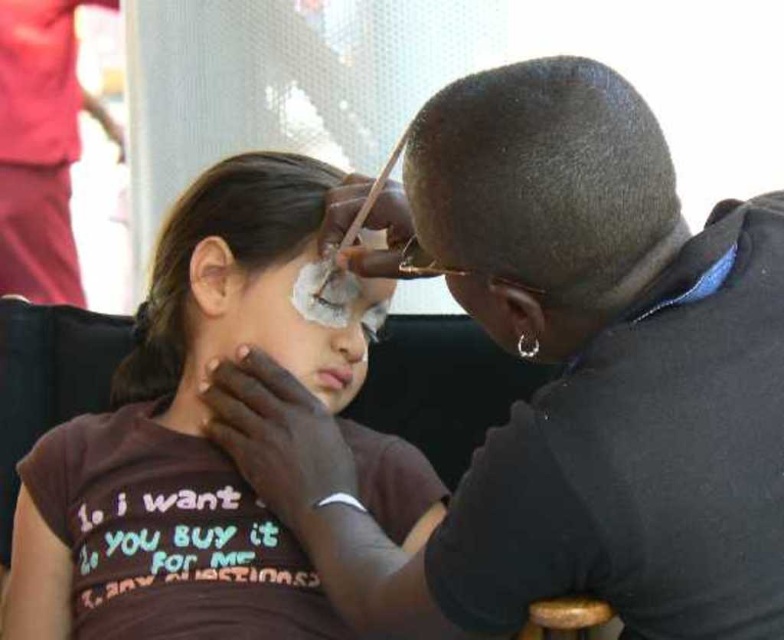
You are a photographer trying to capture a closeup of the makeup application process. You need to focus on either the point at (x=434, y=624) or the point at (x=321, y=330). Which point should you choose to ensure the closest subject detail?

Point (x=434, y=624) is closer to the camera than point (x=321, y=330), so focusing on point (x=434, y=624) will capture the closest subject detail.

You are a makeup artist at a festival booth. You have two face paints available. The smooth skin face paint at upper center and the white matte face paint at center. A customer wants to know which one is bigger. Which one should you recommend?

The smooth skin face paint at upper center has a larger size compared to the white matte face paint at center, so you should recommend the smooth skin face paint at upper center.